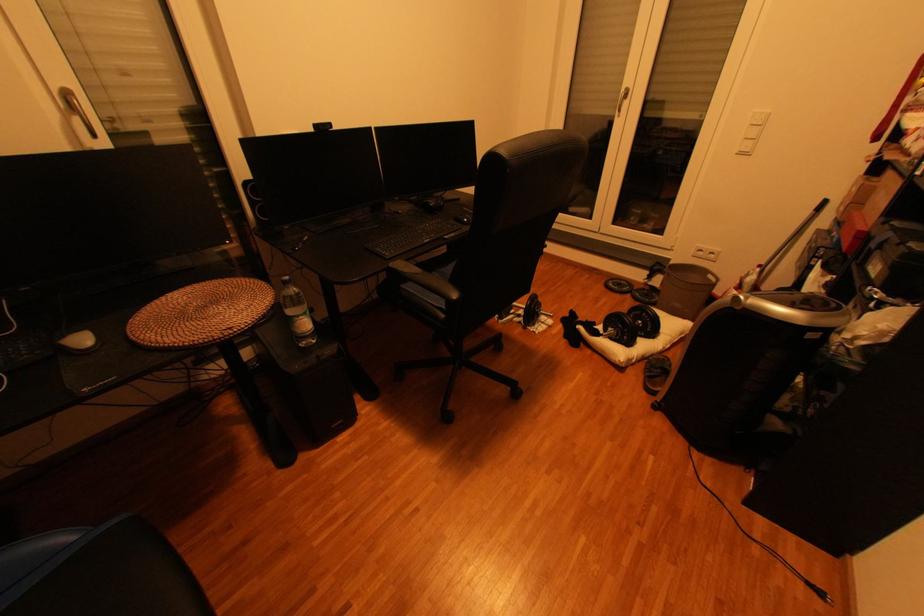
Image resolution: width=924 pixels, height=616 pixels. Describe the element at coordinates (76, 108) in the screenshot. I see `the silver appliance handle` at that location.